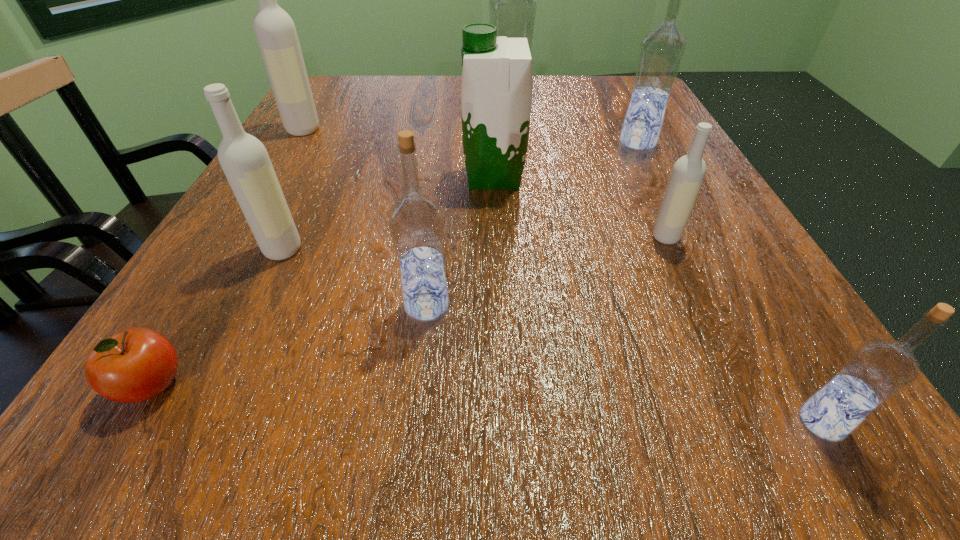
I want to click on vacant space located on the front-facing side of the fourth farthest object, so click(402, 177).

I want to click on vacant point located on the back of the second white vodka from right to left, so click(x=341, y=127).

Find the location of a particular element. The width and height of the screenshot is (960, 540). vacant region located 0.250m on the right of the third vodka from left to right is located at coordinates (642, 305).

At what (x,y) coordinates should I click in order to perform the action: click on vacant space located 0.280m on the back of the rightmost white vodka. Please return your answer as a coordinate pair (x, y). The image size is (960, 540). Looking at the image, I should click on (621, 140).

Find the location of a particular element. The image size is (960, 540). vacant position located 0.090m on the left of the nearest blue vodka is located at coordinates (714, 422).

I want to click on vacant space located 0.110m on the right of the shortest object, so click(x=286, y=385).

Where is `object positioned at the far edge`? Image resolution: width=960 pixels, height=540 pixels. object positioned at the far edge is located at coordinates (513, 2).

Identify the location of vodka that is at the near edge. (877, 370).

At what (x,y) coordinates should I click in order to perform the action: click on apple present at the near edge. Please return your answer as a coordinate pair (x, y). This screenshot has width=960, height=540. Looking at the image, I should click on (137, 364).

The image size is (960, 540). Identify the location of apple positioned at the left edge. (137, 364).